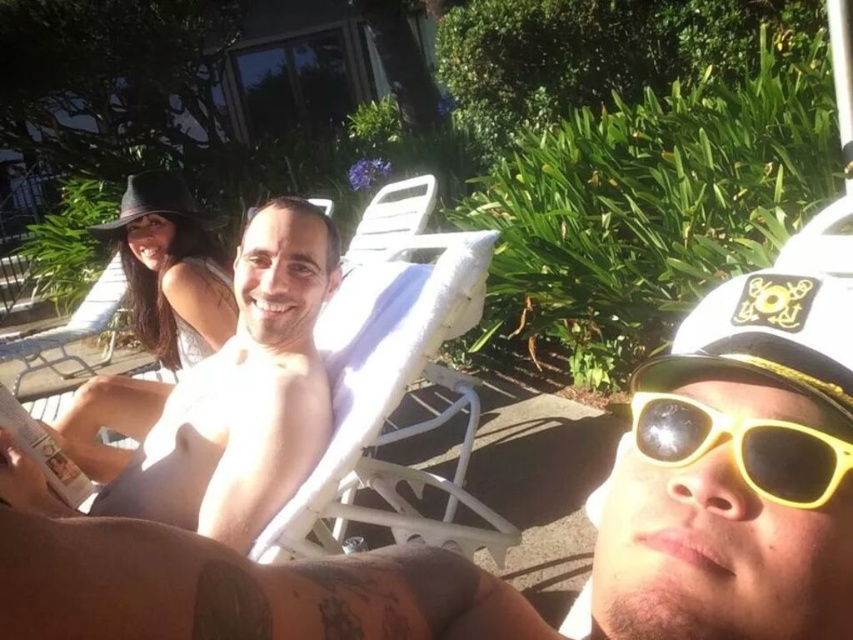
Can you confirm if smooth skin man at center is positioned above black felt hat at upper left?

No, smooth skin man at center is not above black felt hat at upper left.

Does smooth skin man at center lie in front of black felt hat at upper left?

That is True.

Is point (85, 467) positioned behind point (64, 412)?

No, (85, 467) is closer to viewer.

The height and width of the screenshot is (640, 853). Identify the location of smooth skin man at center. (244, 394).

Does point (844, 445) come in front of point (54, 333)?

Yes, point (844, 445) is closer to viewer.

Image resolution: width=853 pixels, height=640 pixels. Describe the element at coordinates (741, 448) in the screenshot. I see `yellow plastic sunglasses at lower right` at that location.

Which is in front, point (711, 444) or point (67, 344)?

Positioned in front is point (711, 444).

This screenshot has width=853, height=640. What are the coordinates of `yellow plastic sunglasses at lower right` in the screenshot? It's located at (741, 448).

Which is behind, point (283, 209) or point (171, 202)?

The point (171, 202) is behind.

Can you confirm if smooth skin man at center is bigger than black felt baseball hat at upper left?

Indeed, smooth skin man at center has a larger size compared to black felt baseball hat at upper left.

You are a GUI agent. You are given a task and a screenshot of the screen. Output one action in this format:
    pyautogui.click(x=<x>, y=<y>)
    Task: Click on the smooth skin man at center
    The image size is (853, 640).
    Given the screenshot: What is the action you would take?
    pyautogui.click(x=244, y=394)

Locate an element on the screen. Image resolution: width=853 pixels, height=640 pixels. smooth skin man at center is located at coordinates (244, 394).